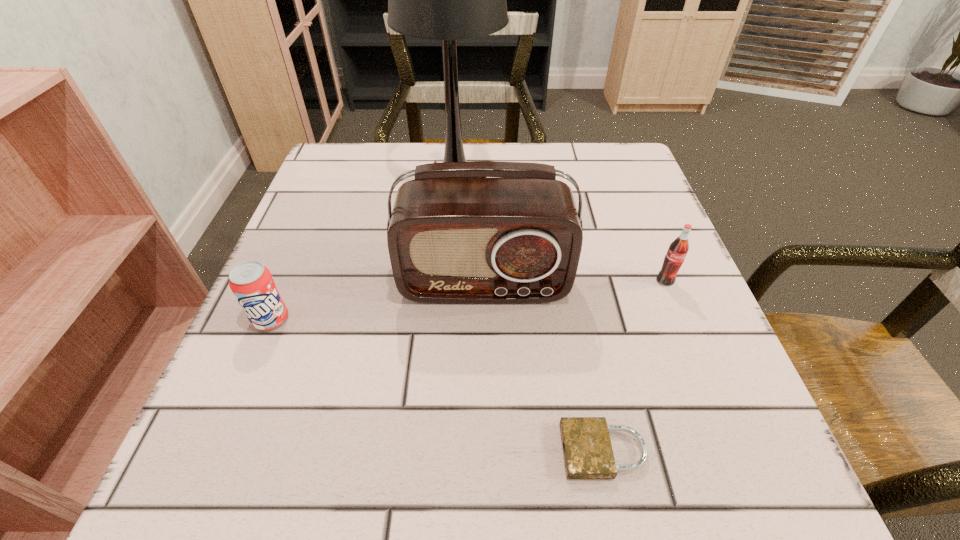
This screenshot has width=960, height=540. Identify the location of padlock that is at the right edge. [588, 454].

The height and width of the screenshot is (540, 960). Find the location of `object that is at the near right corner`. object that is at the near right corner is located at coordinates (x=588, y=454).

Where is `free space at the far edge of the desktop`? Image resolution: width=960 pixels, height=540 pixels. free space at the far edge of the desktop is located at coordinates (521, 149).

Locate an element on the screen. This screenshot has height=540, width=960. vacant space at the near edge of the desktop is located at coordinates (438, 499).

Locate an element on the screen. This screenshot has height=540, width=960. vacant space at the left edge of the desktop is located at coordinates (348, 228).

Image resolution: width=960 pixels, height=540 pixels. What are the coordinates of `vacant point at the right edge` in the screenshot? It's located at (601, 208).

Locate an element on the screen. vacant space at the far left corner of the desktop is located at coordinates (339, 183).

In the image, there is a desktop. Where is `free space at the far right corner`? The height and width of the screenshot is (540, 960). free space at the far right corner is located at coordinates (625, 190).

In the image, there is a desktop. What are the coordinates of `blank space at the near right corner` in the screenshot? It's located at (688, 472).

The image size is (960, 540). Identify the location of empty location between the nearer soda can and the farthest object. (364, 252).